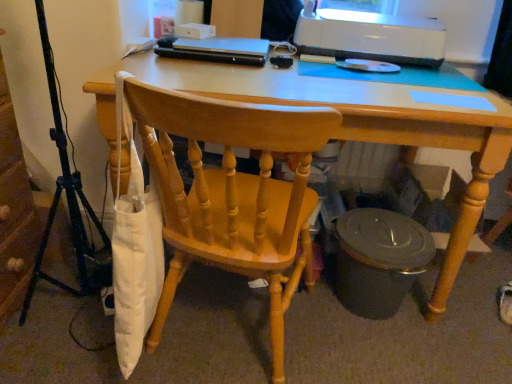
Measure the distance between metallic tripod at left and camera.

metallic tripod at left is 3.47 feet away from camera.

This screenshot has height=384, width=512. What do you see at coordinates (371, 37) in the screenshot? I see `white glossy printer at upper right` at bounding box center [371, 37].

I want to click on white glossy printer at upper right, so click(x=371, y=37).

The image size is (512, 384). What are the coordinates of `metallic tripod at left` in the screenshot? It's located at (66, 196).

Is wooden chair at center far away from light wood desk at center?

wooden chair at center is actually quite close to light wood desk at center.

In the scene shown: How different are the orientations of wooden chair at center and light wood desk at center in degrees?

They differ by 170 degrees in their facing directions.

Between wooden chair at center and light wood desk at center, which one has larger width?

light wood desk at center.

Where is `chair in front of the light wood desk at center`? This screenshot has width=512, height=384. chair in front of the light wood desk at center is located at coordinates (232, 192).

Would you say metallic tripod at left is outside white glossy printer at upper right?

Yes, metallic tripod at left is outside of white glossy printer at upper right.

Based on the photo, considering the sizes of objects metallic tripod at left and white glossy printer at upper right in the image provided, who is bigger, metallic tripod at left or white glossy printer at upper right?

Bigger between the two is metallic tripod at left.

Which object is positioned more to the left, metallic tripod at left or white glossy printer at upper right?

metallic tripod at left is more to the left.

Is wooden chair at center outside of white glossy printer at upper right?

Absolutely, wooden chair at center is external to white glossy printer at upper right.

Considering the relative sizes of wooden chair at center and white glossy printer at upper right in the image provided, is wooden chair at center shorter than white glossy printer at upper right?

No.

From the image's perspective, is wooden chair at center beneath white glossy printer at upper right?

Indeed, from the image's perspective, wooden chair at center is shown beneath white glossy printer at upper right.

Does point (267, 280) lie behind point (348, 11)?

No, (267, 280) is closer to viewer.

How distant is matte black trash can at lower right from metallic tripod at left?

matte black trash can at lower right is 37.63 inches away from metallic tripod at left.

Considering the sizes of objects matte black trash can at lower right and metallic tripod at left in the image provided, who is bigger, matte black trash can at lower right or metallic tripod at left?

Bigger between the two is metallic tripod at left.

From the picture: Is matte black trash can at lower right outside of metallic tripod at left?

Yes, matte black trash can at lower right is outside of metallic tripod at left.

Considering the positions of point (362, 260) and point (92, 251), is point (362, 260) closer or farther from the camera than point (92, 251)?

Point (362, 260).

Is metallic tripod at left facing towards wooden chair at center?

Yes, metallic tripod at left faces towards wooden chair at center.

From a real-world perspective, who is located lower, metallic tripod at left or wooden chair at center?

wooden chair at center, from a real-world perspective.

You are a GUI agent. You are given a task and a screenshot of the screen. Output one action in this format:
    pyautogui.click(x=<x>, y=<y>)
    Task: Click on the chair below the metallic tripod at left (from the image's perspective)
    This screenshot has height=384, width=512.
    Given the screenshot: What is the action you would take?
    pyautogui.click(x=232, y=192)

Visually, is metallic tripod at left positioned to the left or to the right of wooden chair at center?

metallic tripod at left is to the left of wooden chair at center.

Which object is closer to the camera, metallic tripod at left or matte black trash can at lower right?

metallic tripod at left.

Is point (62, 135) positioned in front of point (391, 243)?

No, (62, 135) is further to viewer.

Between metallic tripod at left and matte black trash can at lower right, which one has larger width?

matte black trash can at lower right.

Is there a large distance between metallic tripod at left and matte black trash can at lower right?

That's not correct — metallic tripod at left is a little close to matte black trash can at lower right.

Would you say matte black trash can at lower right is outside wooden chair at center?

Absolutely, matte black trash can at lower right is external to wooden chair at center.

Considering the sizes of matte black trash can at lower right and wooden chair at center in the image, is matte black trash can at lower right taller or shorter than wooden chair at center?

Considering their sizes, matte black trash can at lower right has less height than wooden chair at center.

Is point (353, 247) more distant than point (252, 236)?

Yes, point (353, 247) is farther from viewer.

Is matte black trash can at lower right wider than wooden chair at center?

No.

At what (x,y) coordinates should I click in order to perform the action: click on desk beneath the wooden chair at center (from a real-world perspective). Please return your answer as a coordinate pair (x, y). The width and height of the screenshot is (512, 384). Looking at the image, I should click on (347, 125).

Find the location of a particular element. The width and height of the screenshot is (512, 384). printer behind the metallic tripod at left is located at coordinates (371, 37).

Looking at the image, which one is located closer to white glossy printer at upper right, metallic tripod at left or wooden chair at center?

wooden chair at center is positioned closer to the anchor white glossy printer at upper right.

From the image, which object appears to be farther from metallic tripod at left, matte black trash can at lower right or wooden chair at center?

Based on the image, matte black trash can at lower right appears to be further to metallic tripod at left.

Considering their positions, is light wood desk at center positioned closer to white glossy printer at upper right than wooden chair at center?

light wood desk at center is closer to white glossy printer at upper right.

Based on their spatial positions, is matte black trash can at lower right or white glossy printer at upper right closer to wooden chair at center?

matte black trash can at lower right is closer to wooden chair at center.

Considering their positions, is matte black trash can at lower right positioned further to white glossy printer at upper right than wooden chair at center?

wooden chair at center is further to white glossy printer at upper right.

In the scene shown: Which object lies further to the anchor point matte black trash can at lower right, metallic tripod at left or white glossy printer at upper right?

Based on the image, metallic tripod at left appears to be further to matte black trash can at lower right.

Considering their positions, is light wood desk at center positioned further to wooden chair at center than white glossy printer at upper right?

Among the two, white glossy printer at upper right is located further to wooden chair at center.

Looking at the image, which one is located further to light wood desk at center, metallic tripod at left or white glossy printer at upper right?

metallic tripod at left.

The width and height of the screenshot is (512, 384). I want to click on desk between wooden chair at center and matte black trash can at lower right along the z-axis, so click(x=347, y=125).

Locate an element on the screen. This screenshot has width=512, height=384. side table between metallic tripod at left and white glossy printer at upper right is located at coordinates (378, 260).

I want to click on desk located between metallic tripod at left and white glossy printer at upper right in the left-right direction, so click(347, 125).

Locate an element on the screen. This screenshot has width=512, height=384. desk located between metallic tripod at left and matte black trash can at lower right in the left-right direction is located at coordinates (347, 125).